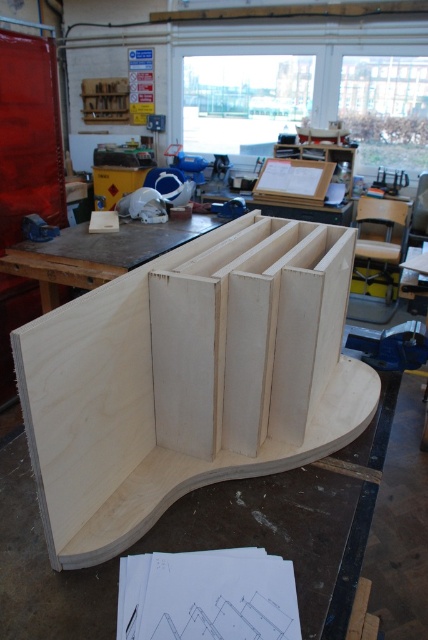
Between point (115, 241) and point (27, 214), which one is positioned in front?

Point (115, 241) is in front.

Is natural wood table at center to the left of metallic blue vise at left from the viewer's perspective?

In fact, natural wood table at center is to the right of metallic blue vise at left.

Locate an element on the screen. natural wood table at center is located at coordinates (97, 253).

Consider the image. Does natural wood plywood at center appear over metallic blue vise at left?

Actually, natural wood plywood at center is below metallic blue vise at left.

Which is in front, point (305, 369) or point (53, 236)?

Positioned in front is point (305, 369).

Locate an element on the screen. natural wood plywood at center is located at coordinates (189, 380).

The height and width of the screenshot is (640, 428). What do you see at coordinates (189, 380) in the screenshot?
I see `natural wood plywood at center` at bounding box center [189, 380].

Is natural wood plywood at center shorter than natural wood table at center?

Incorrect, natural wood plywood at center's height does not fall short of natural wood table at center's.

Does point (35, 337) come farther from viewer compared to point (41, 300)?

That is False.

Locate an element on the screen. The width and height of the screenshot is (428, 640). natural wood plywood at center is located at coordinates (189, 380).